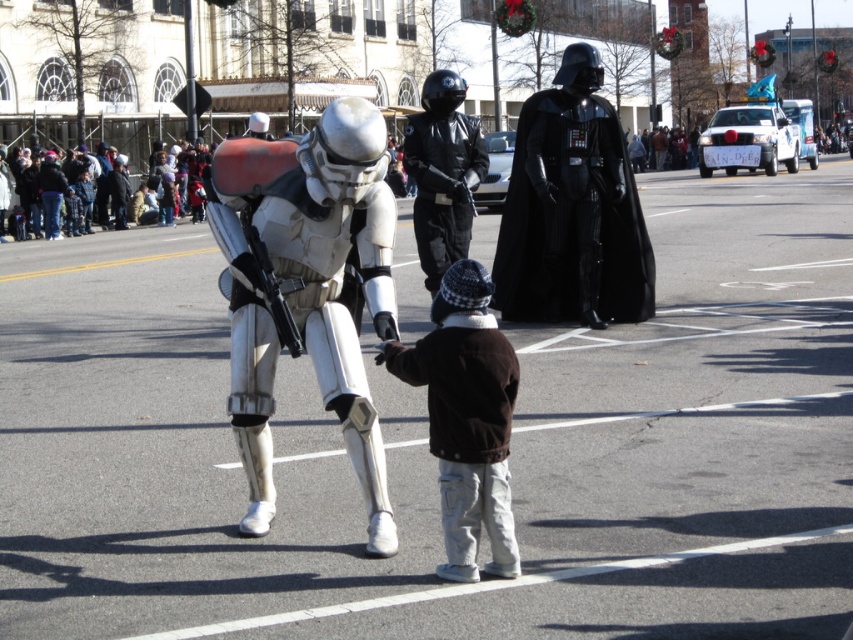
Consider the image. Which of these two, brown fuzzy jacket at center or black leather jacket at center, stands shorter?

A: With less height is brown fuzzy jacket at center.

How much distance is there between brown fuzzy jacket at center and black leather jacket at center?

brown fuzzy jacket at center and black leather jacket at center are 18.48 feet apart.

What do you see at coordinates (466, 419) in the screenshot? I see `brown fuzzy jacket at center` at bounding box center [466, 419].

Locate an element on the screen. brown fuzzy jacket at center is located at coordinates (466, 419).

This screenshot has height=640, width=853. Describe the element at coordinates (306, 292) in the screenshot. I see `white matte armor at center` at that location.

Which of these two, white matte armor at center or brown fuzzy jacket at center, stands taller?

white matte armor at center

Is point (235, 348) behind point (471, 440)?

That is True.

At what (x,y) coordinates should I click in order to perform the action: click on white matte armor at center. Please return your answer as a coordinate pair (x, y). The height and width of the screenshot is (640, 853). Looking at the image, I should click on (306, 292).

Does black matte/soft darth vader at center appear on the left side of brown fuzzy jacket at center?

No, black matte/soft darth vader at center is not to the left of brown fuzzy jacket at center.

Is black matte/soft darth vader at center closer to camera compared to brown fuzzy jacket at center?

No, black matte/soft darth vader at center is further to the viewer.

Which is in front, point (612, 161) or point (451, 458)?

Point (451, 458) is in front.

This screenshot has width=853, height=640. I want to click on black matte/soft darth vader at center, so click(x=572, y=209).